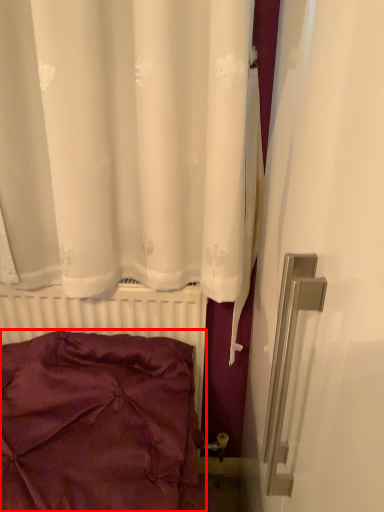
Question: In this image, where is pillow (annotated by the red box) located relative to radiator?

Choices:
 (A) right
 (B) left

Answer: (B)